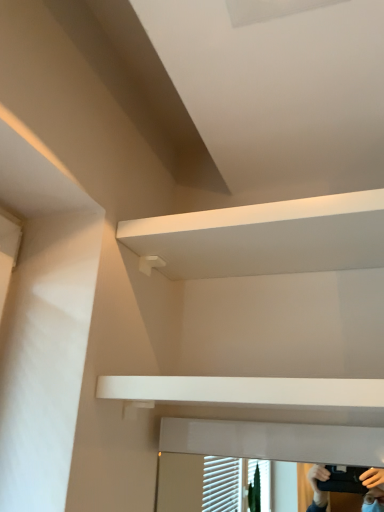
You are a GUI agent. You are given a task and a screenshot of the screen. Output one action in this format:
    pyautogui.click(x=<x>, y=<y>)
    Task: Click on the white matte shelf at upper center
    The height and width of the screenshot is (512, 384).
    Given the screenshot: What is the action you would take?
    pyautogui.click(x=265, y=237)

In the scene shown: Measure the distance between white matte shelf at upper center and camera.

28.02 inches.

The height and width of the screenshot is (512, 384). What do you see at coordinates (265, 237) in the screenshot? I see `white matte shelf at upper center` at bounding box center [265, 237].

Locate an element on the screen. The width and height of the screenshot is (384, 512). white matte shelf at upper center is located at coordinates (265, 237).